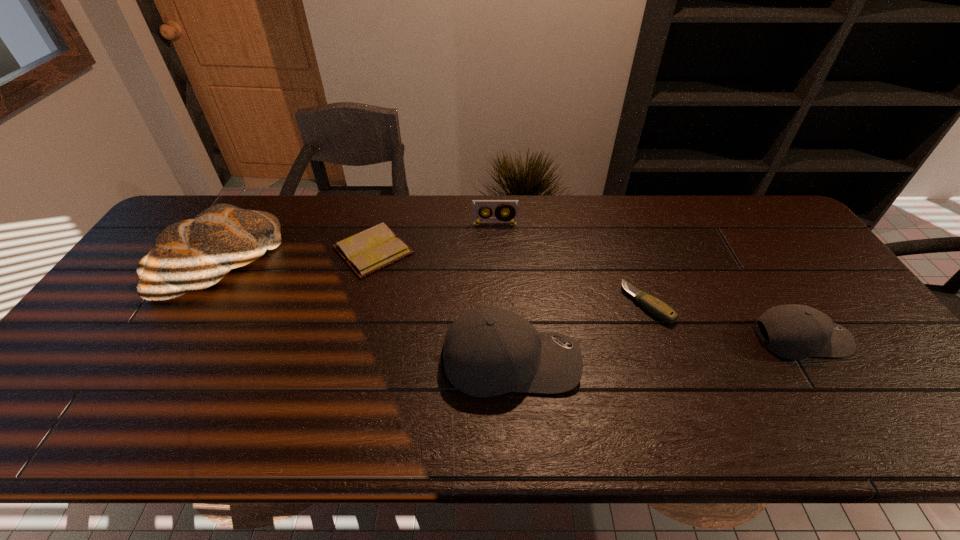
Find the location of a particular element. The image size is (960, 540). free space located on the front brim of the right baseball cap is located at coordinates (879, 338).

The height and width of the screenshot is (540, 960). In order to click on free space located 0.090m at the front of the videotape with visible reels in this screenshot , I will do `click(495, 244)`.

Where is `vacant space located 0.280m on the left of the second shortest object`? vacant space located 0.280m on the left of the second shortest object is located at coordinates (521, 304).

Find the location of a particular element. This screenshot has width=960, height=540. vacant space located on the right of the leftmost object is located at coordinates (305, 262).

Image resolution: width=960 pixels, height=540 pixels. In order to click on vacant space located on the right of the diary in this screenshot , I will do `click(510, 250)`.

This screenshot has height=540, width=960. In order to click on videotape located in the far edge section of the desktop in this screenshot , I will do `click(498, 217)`.

The image size is (960, 540). I want to click on bread that is at the far edge, so click(x=194, y=254).

Locate an element on the screen. The image size is (960, 540). diary that is positioned at the far edge is located at coordinates (377, 247).

Locate an element on the screen. Image resolution: width=960 pixels, height=540 pixels. object located at the near edge is located at coordinates (487, 352).

Identify the location of object that is at the left edge. (194, 254).